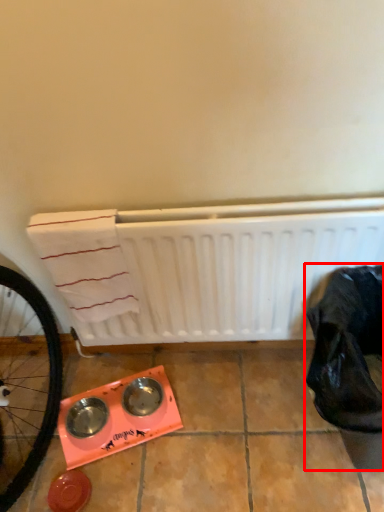
Question: From the image's perspective, what is the correct spatial relationship of waste (annotated by the red box) in relation to water heater?

Choices:
 (A) below
 (B) above

Answer: (A)